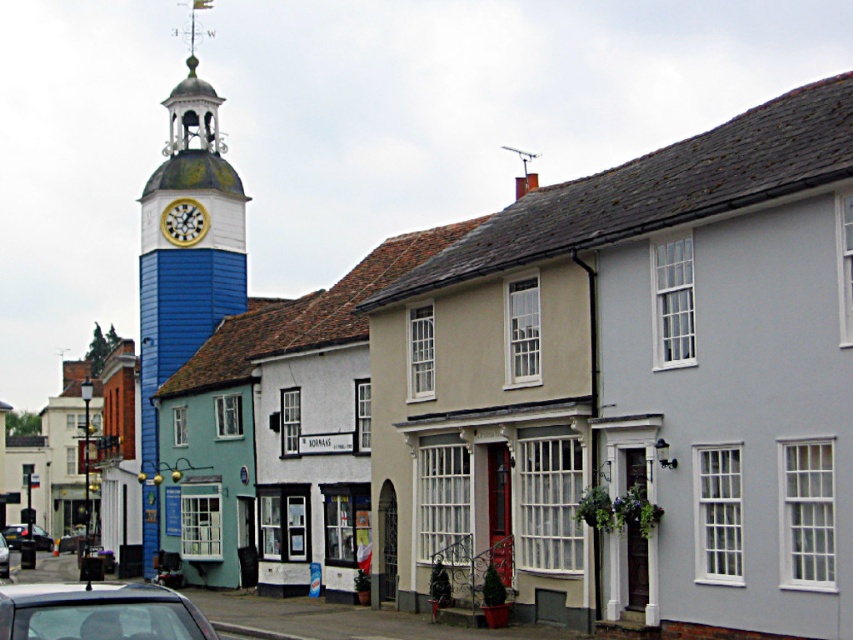
Question: Which object is farther from the camera taking this photo?

Choices:
 (A) metallic gray car at lower left
 (B) metallic silver car at lower left

Answer: (B)

Question: Is gold metallic clock at upper center thinner than metallic silver car at lower left?

Choices:
 (A) no
 (B) yes

Answer: (B)

Question: Can you confirm if blue painted wood clock tower at left is wider than metallic silver car at lower left?

Choices:
 (A) no
 (B) yes

Answer: (B)

Question: Can you confirm if blue painted wood clock tower at left is positioned to the right of gold metallic clock at upper center?

Choices:
 (A) yes
 (B) no

Answer: (B)

Question: Among these objects, which one is nearest to the camera?

Choices:
 (A) metallic gray car at lower left
 (B) blue painted wood clock tower at left
 (C) matte black car at lower left
 (D) metallic silver car at lower left

Answer: (C)

Question: Which of the following is the farthest from the observer?

Choices:
 (A) (0, 545)
 (B) (16, 588)

Answer: (A)